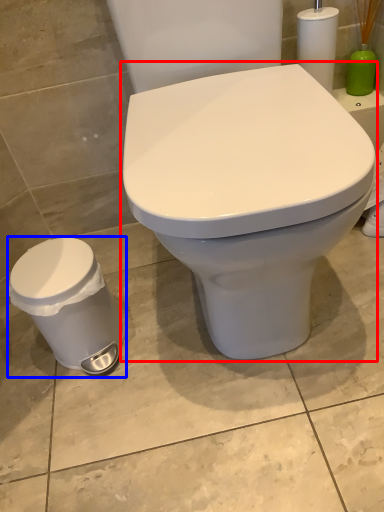
Question: Which point is further to the camera, toilet (highlighted by a red box) or porcelain (highlighted by a blue box)?

Choices:
 (A) toilet
 (B) porcelain

Answer: (B)